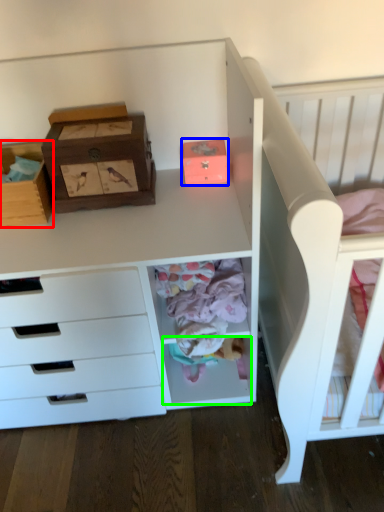
Question: Based on their relative distances, which object is farther from cardboard box (highlighted by a red box)? Choose from shoe box (highlighted by a blue box) and drawer (highlighted by a green box).

Choices:
 (A) shoe box
 (B) drawer

Answer: (B)